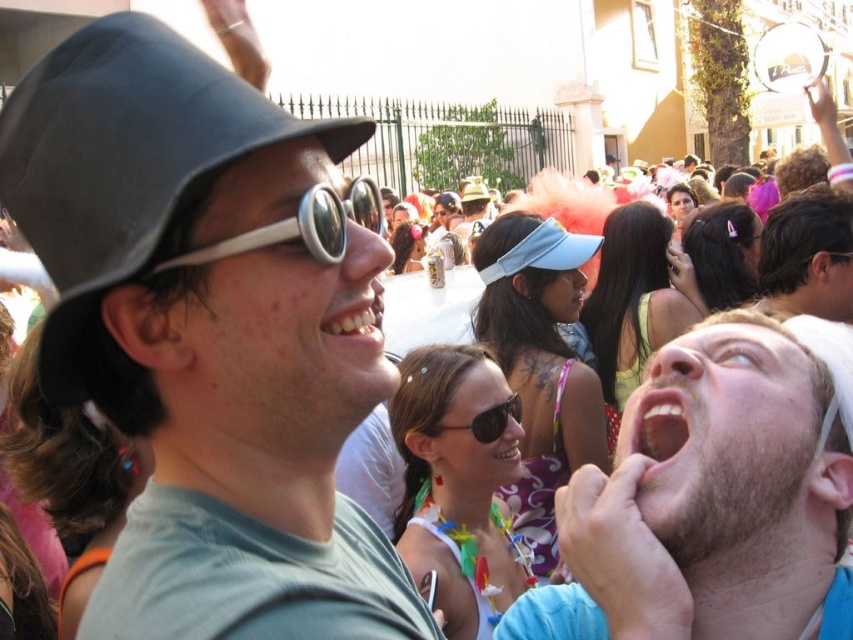
Based on the photo, you are standing in the crowd at the festival and want to locate the smooth brown hair at center. What are the coordinates where you should look?

The coordinates to locate the smooth brown hair at center are at point (808, 257).